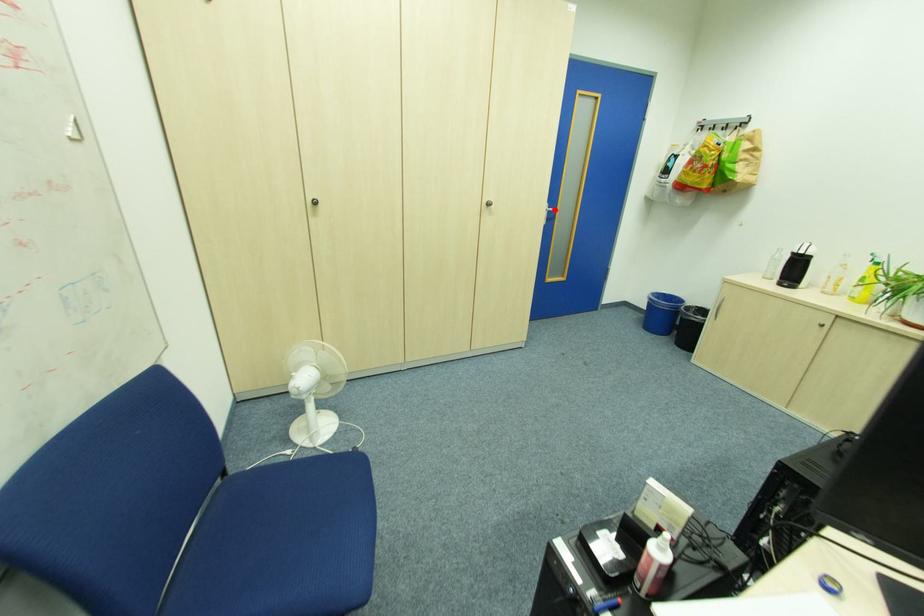
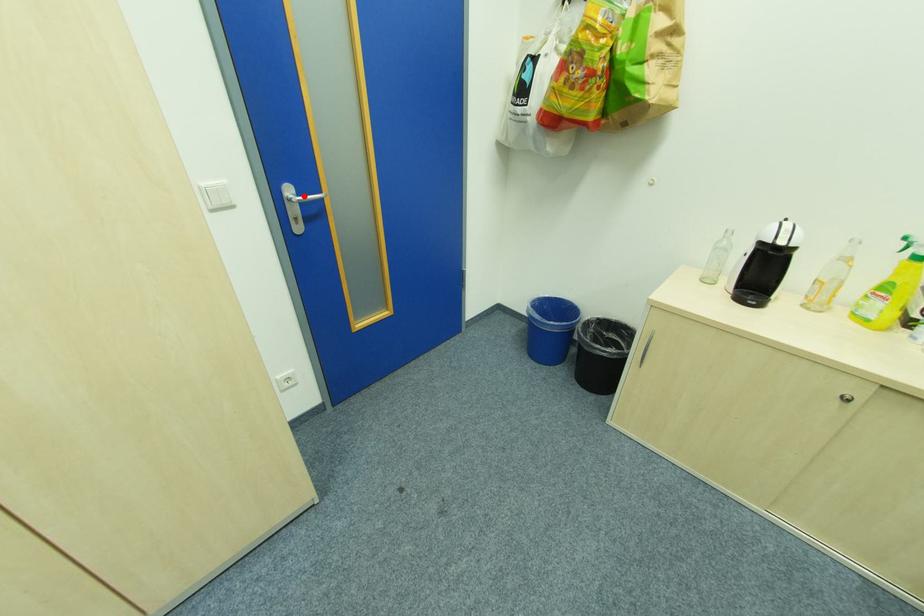
I am providing you with two images of the same scene from different viewpoints. A red point is marked on the first image and another point is marked on the second image. Are the points marked in image1 and image2 representing the same 3D position?

Yes